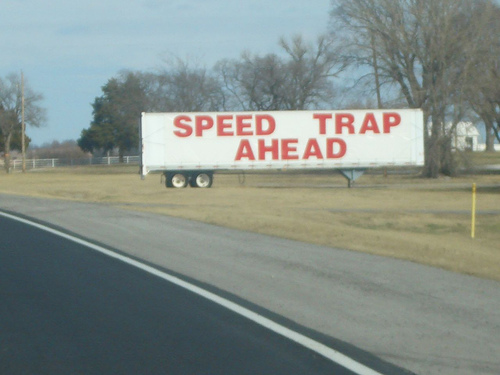
I want to click on white roof, so click(457, 126).